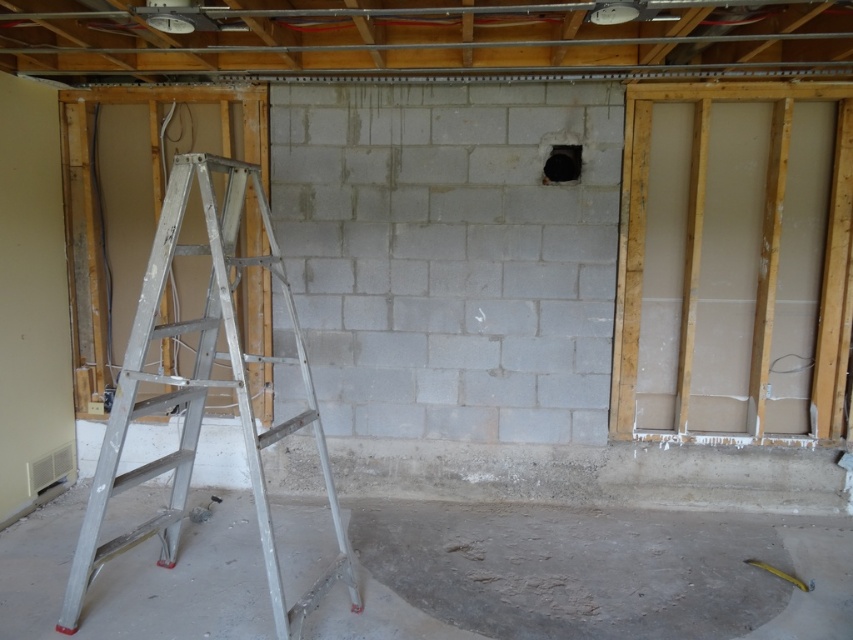
You are a construction worker who needs to move a heavy tool from the silver metallic ladder at left to the smooth concrete floor at lower center. Which direction should you move the tool relative to the ladder?

The smooth concrete floor at lower center is to the right of the silver metallic ladder at left, so you should move the tool to the right of the ladder.

From the picture: You are a construction worker carrying a 36 inch long tool. You need to place it between the smooth concrete floor at lower center and the silver metallic ladder at left. Can the tool fit in that space?

The smooth concrete floor at lower center and the silver metallic ladder at left are 37.12 inches apart. Since the tool is 36 inches long, it can fit in the space between them.